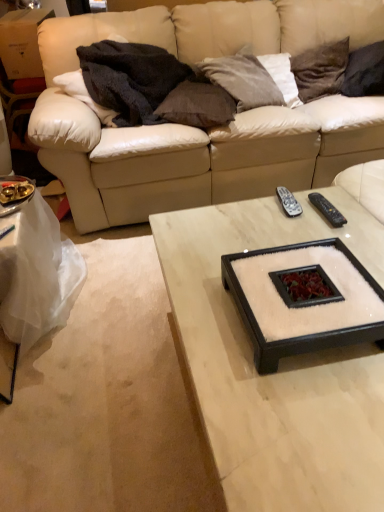
Identify the location of vacant space that is to the left of black plastic remote control at center, the 2th remote control when ordered from right to left. The height and width of the screenshot is (512, 384). (247, 213).